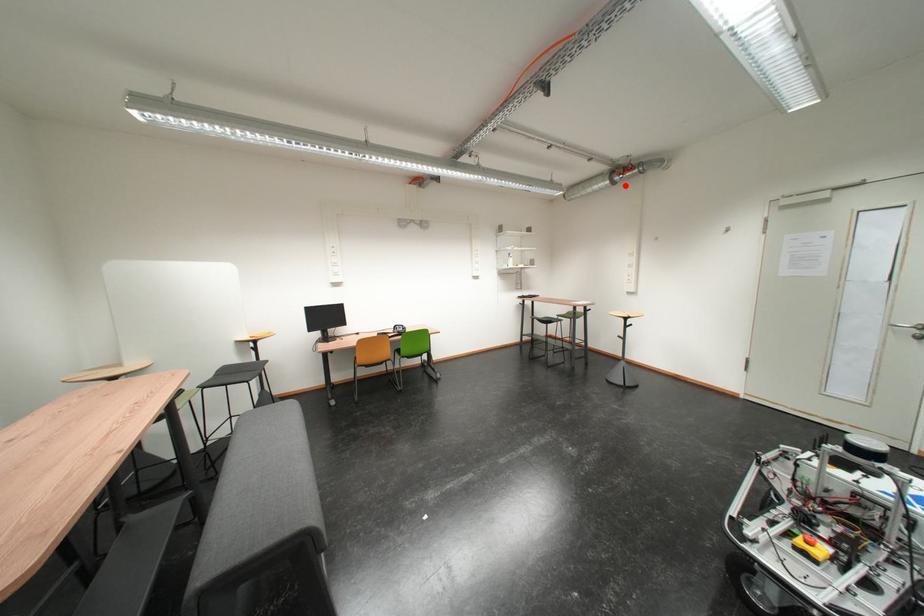
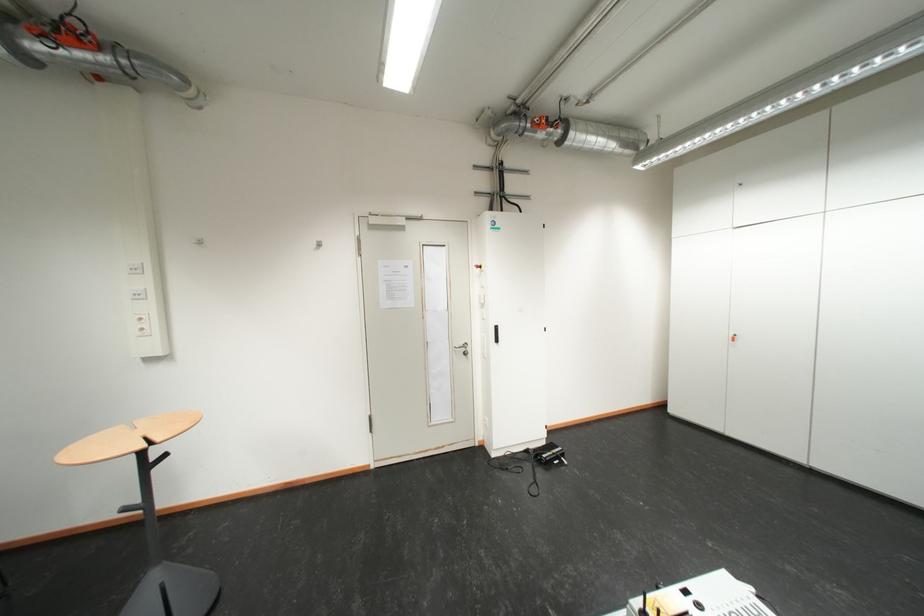
Find the pixel in the second image that matches the highlighted location in the first image.

(35, 60)